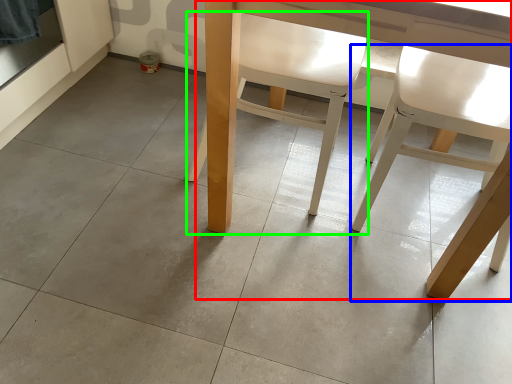
Question: Which object is positioned closest to table (highlighted by a red box)? Select from chair (highlighted by a blue box) and chair (highlighted by a green box).

Choices:
 (A) chair
 (B) chair

Answer: (B)